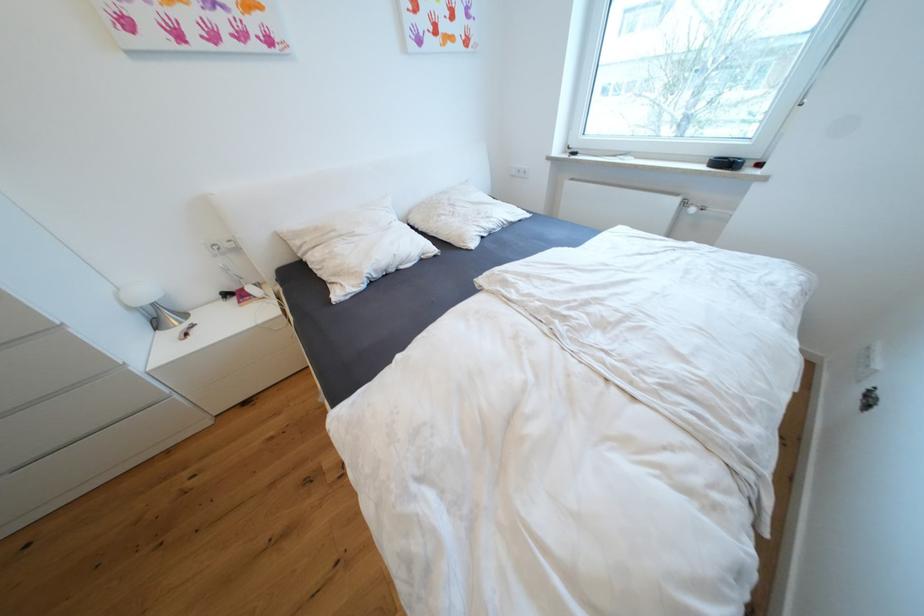
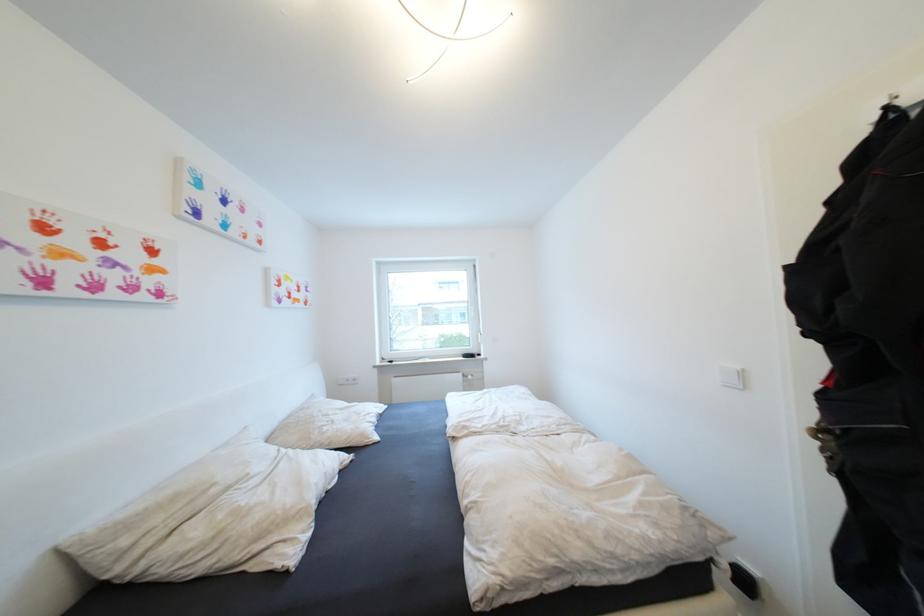
Where in the second image is the point corresponding to the point at 460,215 from the first image?

(339, 423)